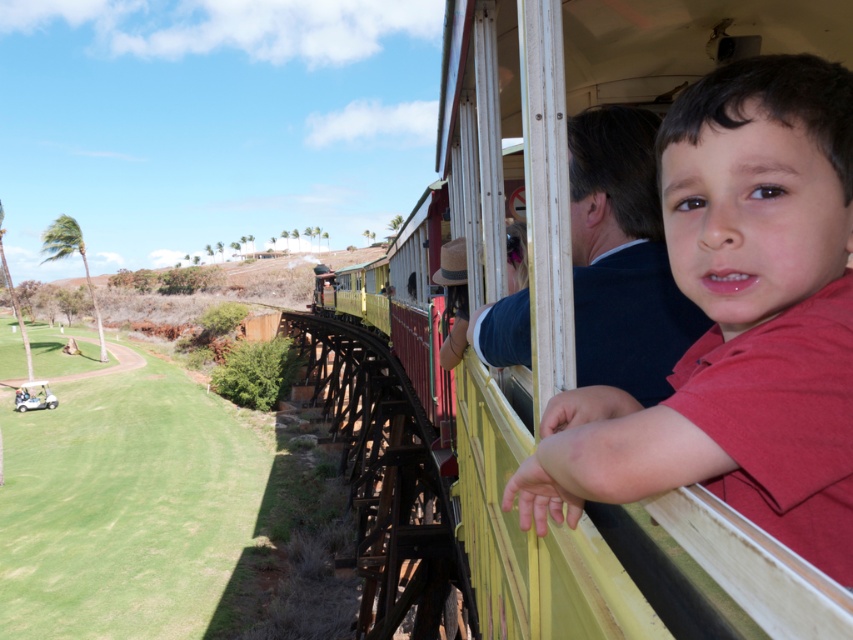
Measure the distance between matte red shirt at center and camera.

matte red shirt at center is 50.68 centimeters from camera.

Is matte red shirt at center closer to the viewer compared to green grass at lower left?

Yes, matte red shirt at center is closer to the viewer.

The height and width of the screenshot is (640, 853). Find the location of `matte red shirt at center`. matte red shirt at center is located at coordinates (737, 321).

Locate an element on the screen. The height and width of the screenshot is (640, 853). matte red shirt at center is located at coordinates (737, 321).